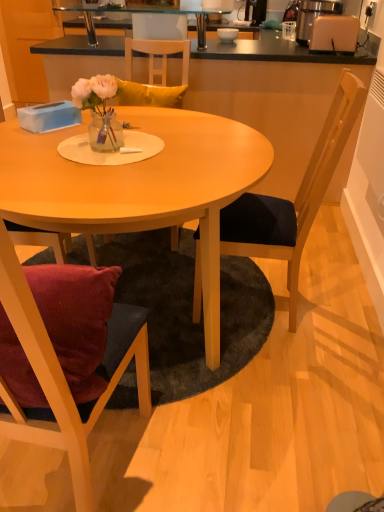
Find the location of a particular element. vacant area that is in front of black fabric chair at right, which appears as the first chair when viewed from the right is located at coordinates (318, 375).